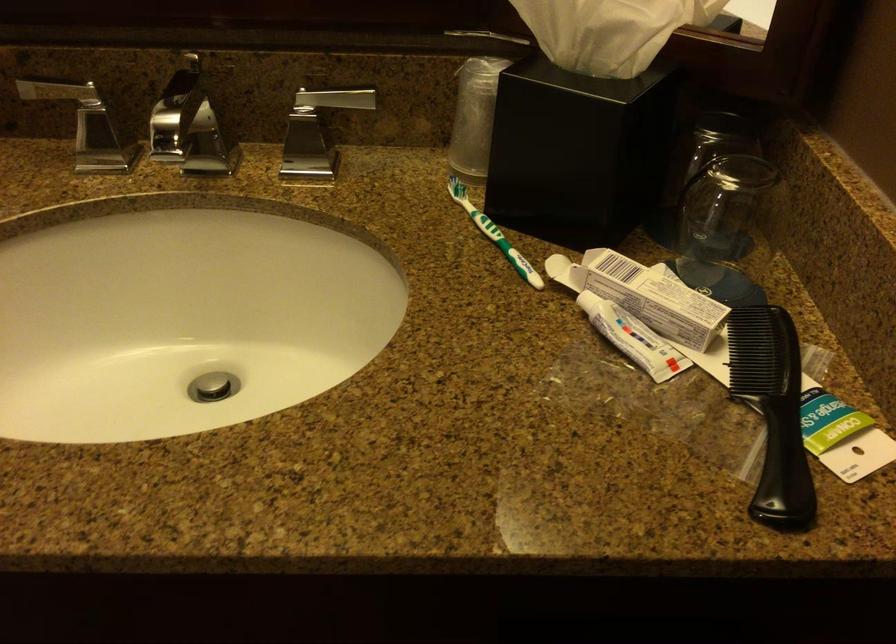
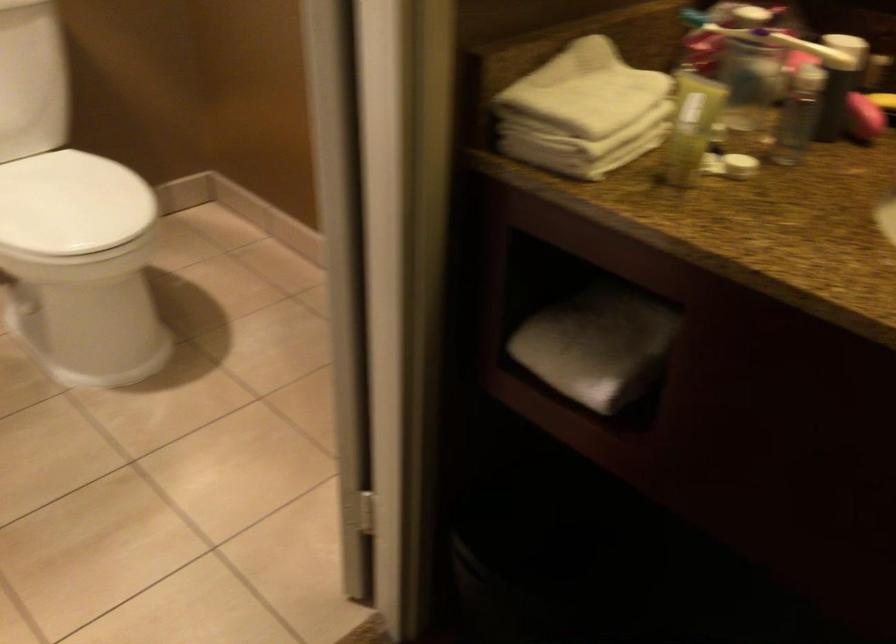
Question: The camera is either moving clockwise (left) or counter-clockwise (right) around the object. The first image is from the beginning of the video and the second image is from the end. Is the camera moving left or right when shooting the video?

Choices:
 (A) Left
 (B) Right

Answer: (B)